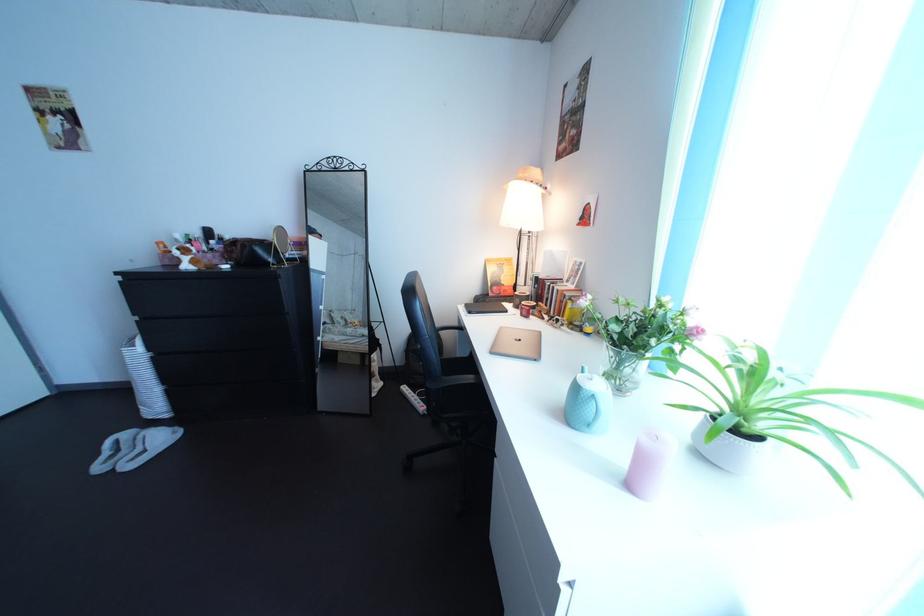
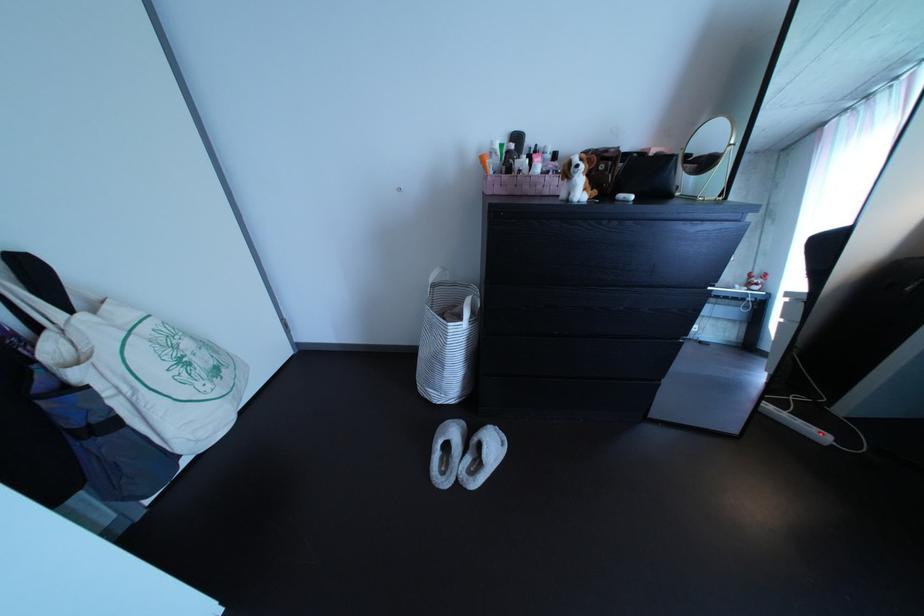
Question: The images are taken continuously from a first-person perspective. In which direction are you moving?

Choices:
 (A) Left
 (B) Right
 (C) Forward
 (D) Backward

Answer: (A)